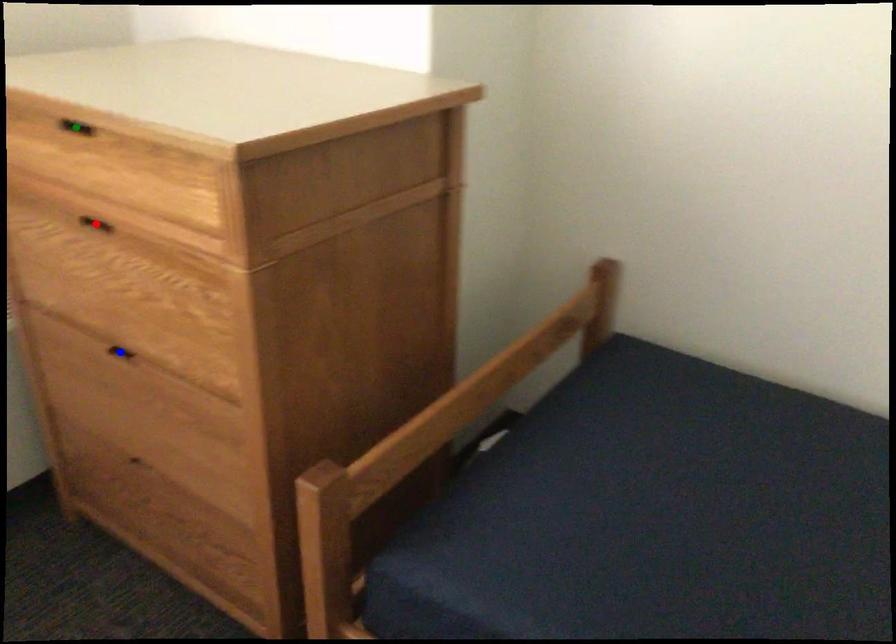
Order these from nearest to farthest:
blue point | red point | green point

1. green point
2. red point
3. blue point